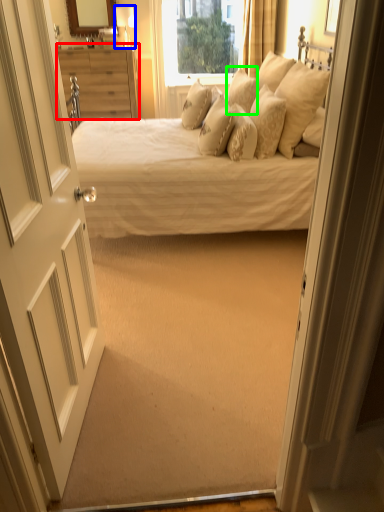
Question: Estimate the real-world distances between objects in this image. Which object is farther from nightstand (highlighted by a red box), lamp (highlighted by a blue box) or pillow (highlighted by a green box)?

Choices:
 (A) lamp
 (B) pillow

Answer: (B)